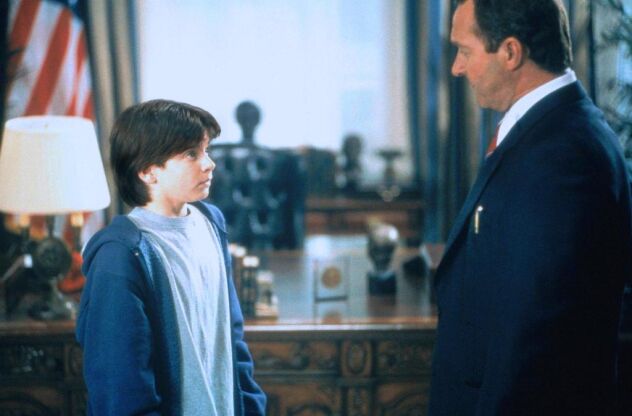
Locate an element on the screen. table is located at coordinates click(341, 318).